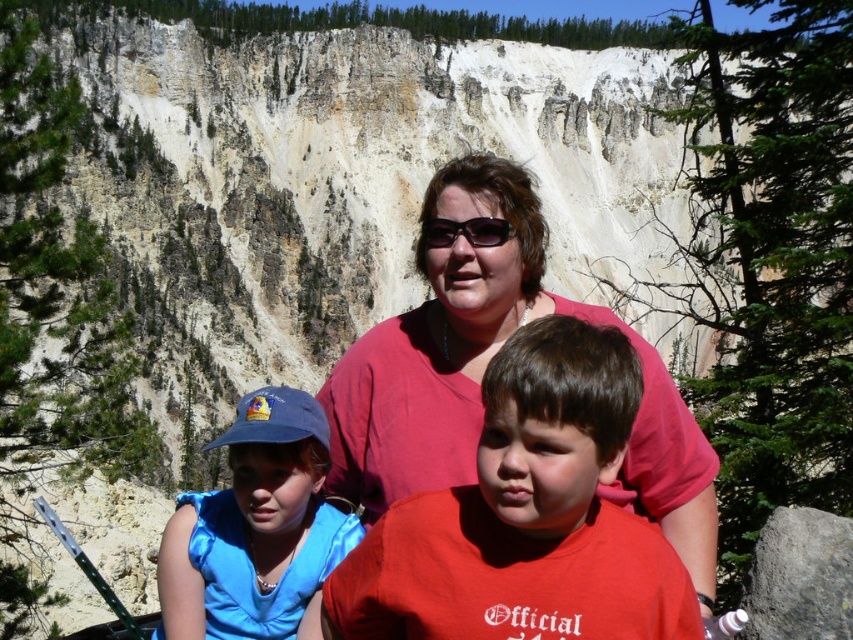
Is gray rough rock at lower right shorter than matte black sunglasses at center?

In fact, gray rough rock at lower right may be taller than matte black sunglasses at center.

Who is taller, gray rough rock at lower right or matte black sunglasses at center?

gray rough rock at lower right

Between point (809, 616) and point (445, 225), which one is positioned behind?

Positioned behind is point (445, 225).

Find the location of `gray rough rock at lower right`. gray rough rock at lower right is located at coordinates (799, 577).

Between blue satin cap at left and matte black sunglasses at center, which one appears on the left side from the viewer's perspective?

blue satin cap at left

Who is higher up, blue satin cap at left or matte black sunglasses at center?

Positioned higher is matte black sunglasses at center.

Describe the element at coordinates (256, 529) in the screenshot. I see `blue satin cap at left` at that location.

Locate an element on the screen. blue satin cap at left is located at coordinates (256, 529).

Who is more distant from viewer, (306, 588) or (836, 541)?

Positioned behind is point (306, 588).

Is blue satin cap at left taller than gray rough rock at lower right?

Correct, blue satin cap at left is much taller as gray rough rock at lower right.

Is point (294, 547) less distant than point (833, 608)?

No.

I want to click on blue satin cap at left, so [256, 529].